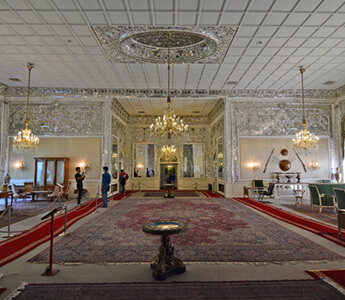
You are a GUI agent. You are given a task and a screenshot of the screen. Output one action in this format:
    pyautogui.click(x=<x>, y=<y>)
    Task: Click on the small golden table
    Image resolution: width=345 pixels, height=300 pixels.
    Given the screenshot: What is the action you would take?
    pyautogui.click(x=166, y=257)